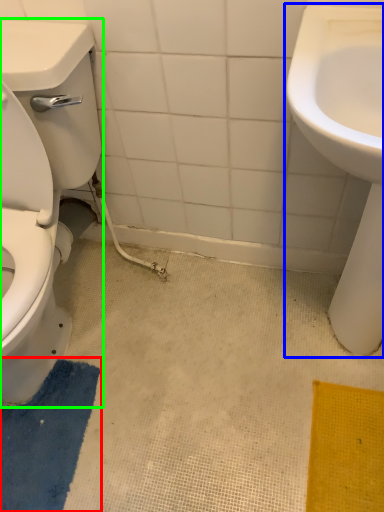
Question: Based on their relative distances, which object is farther from bath mat (highlighted by a red box)? Choose from sink (highlighted by a blue box) and porcelain (highlighted by a green box).

Choices:
 (A) sink
 (B) porcelain

Answer: (A)